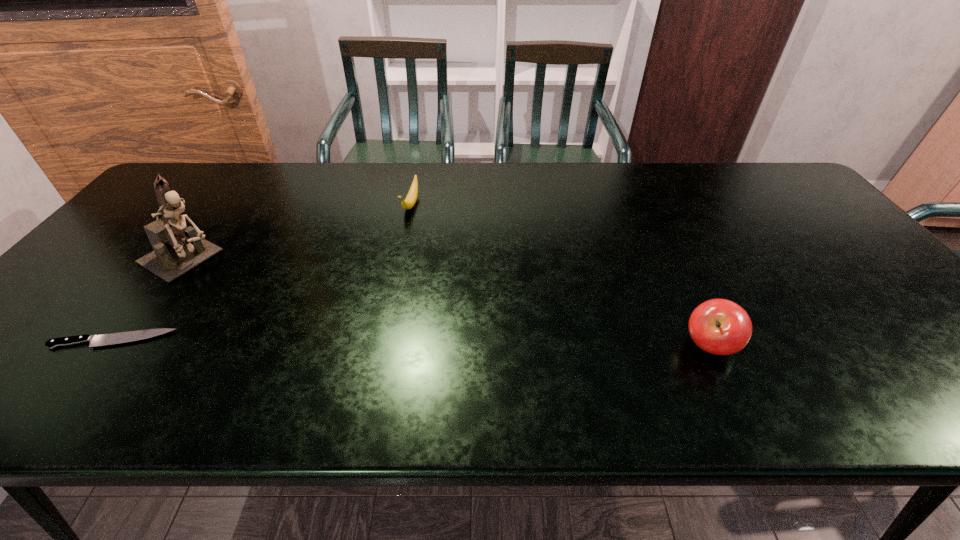
Where is `empty location between the figurine and the shortest object`? The image size is (960, 540). empty location between the figurine and the shortest object is located at coordinates (151, 299).

Locate an element on the screen. The image size is (960, 540). blank region between the steak knife and the third nearest object is located at coordinates (151, 299).

At what (x,y) coordinates should I click in order to perform the action: click on blank region between the second shortest object and the second farthest object. Please return your answer as a coordinate pair (x, y). The image size is (960, 540). Looking at the image, I should click on (300, 231).

You are a GUI agent. You are given a task and a screenshot of the screen. Output one action in this format:
    pyautogui.click(x=<x>, y=<y>)
    Task: Click on the free area in between the farthest object and the figurine
    
    Given the screenshot: What is the action you would take?
    pyautogui.click(x=300, y=231)

You are a GUI agent. You are given a task and a screenshot of the screen. Output one action in this format:
    pyautogui.click(x=<x>, y=<y>)
    Task: Click on the free spot between the rightmost object and the steak knife
    
    Given the screenshot: What is the action you would take?
    pyautogui.click(x=412, y=343)

Identify the location of vacant space that is in between the second tallest object and the second object from right to left. The width and height of the screenshot is (960, 540). (561, 275).

I want to click on vacant region between the third object from left to right and the rightmost object, so click(561, 275).

Select which object appears as the closest to the third nearest object. Please provide its 2D coordinates. Your answer should be formatted as a tuple, i.e. [(x, y)], where the tuple contains the x and y coordinates of a point satisfying the conditions above.

[(114, 338)]

Find the location of a particular element. the third closest object to the steak knife is located at coordinates (718, 326).

At what (x,y) coordinates should I click in order to perform the action: click on vacant area in the image that satisfies the following two spatial constraints: 1. on the front side of the apple; 2. on the stem of the steak knife. Please return your answer as a coordinate pair (x, y). The height and width of the screenshot is (540, 960). Looking at the image, I should click on (108, 346).